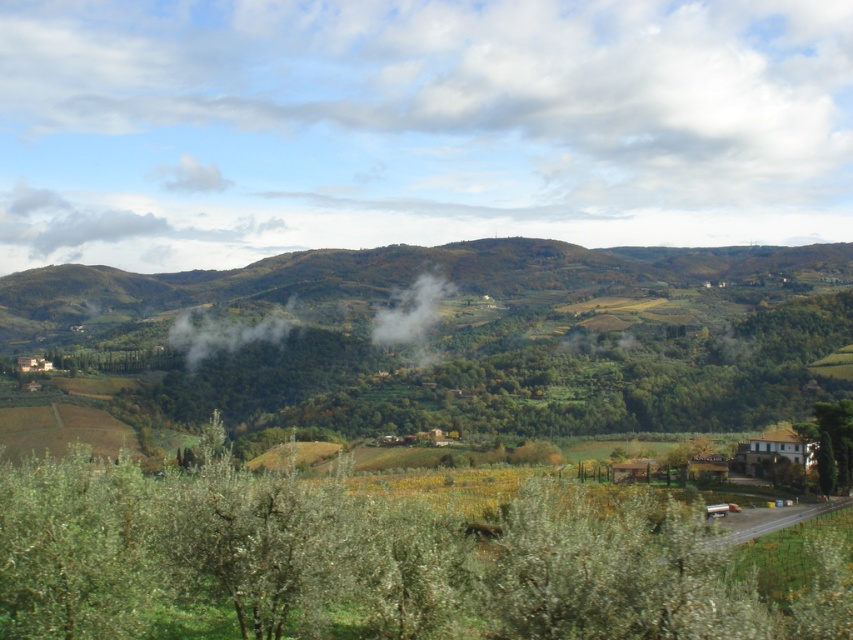
Question: Is green leafy tree at lower left below green leafy forest at center?

Choices:
 (A) yes
 (B) no

Answer: (A)

Question: Which object is positioned closest to the green leafy forest at center?

Choices:
 (A) green leafy tree at lower right
 (B) green leafy tree at lower left

Answer: (A)

Question: Which point appears closest to the camera in this image?

Choices:
 (A) (334, 301)
 (B) (48, 461)
 (C) (817, 413)

Answer: (B)

Question: Is the position of green leafy tree at lower left less distant than that of green leafy tree at lower right?

Choices:
 (A) yes
 (B) no

Answer: (A)

Question: Which of the following is the farthest from the observer?

Choices:
 (A) (561, 291)
 (B) (149, 582)
 (C) (833, 472)

Answer: (A)

Question: Can you confirm if green leafy forest at center is smaller than green leafy tree at lower right?

Choices:
 (A) yes
 (B) no

Answer: (B)